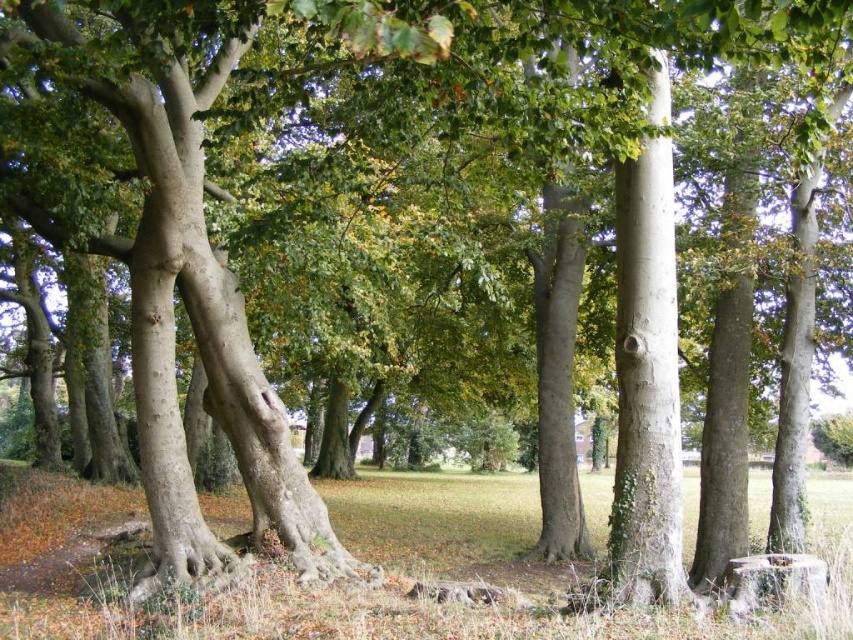
Question: Does green grass at lower center have a greater width compared to smooth gray tree trunk at center?

Choices:
 (A) yes
 (B) no

Answer: (A)

Question: Can you confirm if green grass at lower center is thinner than smooth gray tree trunk at center?

Choices:
 (A) yes
 (B) no

Answer: (B)

Question: Which object appears closest to the camera in this image?

Choices:
 (A) smooth gray tree trunk at center
 (B) green grass at lower center

Answer: (B)

Question: Does green grass at lower center appear on the right side of smooth gray tree trunk at center?

Choices:
 (A) no
 (B) yes

Answer: (A)